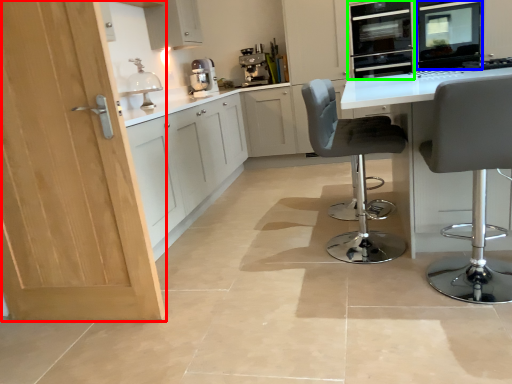
Question: Which is farther away from door (highlighted by a red box)? appliance (highlighted by a blue box) or oven (highlighted by a green box)?

Choices:
 (A) appliance
 (B) oven

Answer: (B)